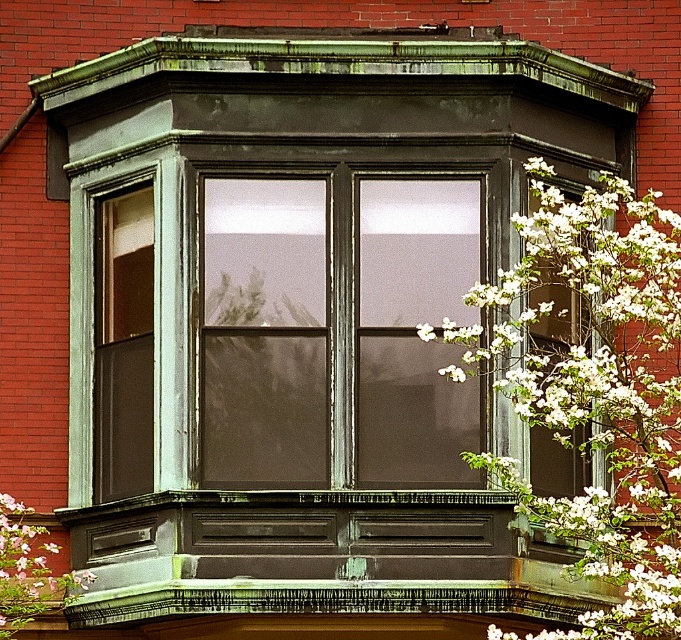
Is white blossoms at right below white blossoms at upper right?

No, white blossoms at right is not below white blossoms at upper right.

Does white blossoms at right have a greater height compared to white blossoms at upper right?

Correct, white blossoms at right is much taller as white blossoms at upper right.

This screenshot has width=681, height=640. What do you see at coordinates (597, 387) in the screenshot?
I see `white blossoms at right` at bounding box center [597, 387].

Find the location of a particular element. The height and width of the screenshot is (640, 681). white blossoms at right is located at coordinates (597, 387).

What do you see at coordinates (268, 330) in the screenshot? This screenshot has height=640, width=681. I see `matte glass window at center` at bounding box center [268, 330].

Who is more forward, (x=238, y=426) or (x=0, y=600)?

Positioned in front is point (x=0, y=600).

Is point (396, 440) behind point (5, 547)?

Yes, point (396, 440) is behind point (5, 547).

Where is `matte glass window at center`? matte glass window at center is located at coordinates (268, 330).

Is matte glass window at center wider than white blossoms at right?

No, matte glass window at center is not wider than white blossoms at right.

Is point (419, 225) positioned in front of point (560, 394)?

No, (419, 225) is behind (560, 394).

Find the location of a particular element. This screenshot has width=681, height=640. matte glass window at center is located at coordinates (268, 330).